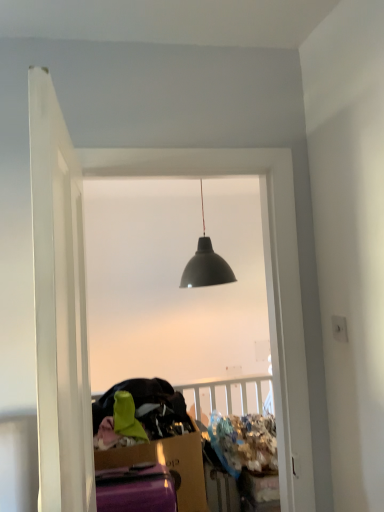
Question: Relative to white smooth door at left, is matte black lampshade at center in front or behind?

Choices:
 (A) front
 (B) behind

Answer: (B)

Question: Does point (168, 289) appear closer or farther from the camera than point (46, 408)?

Choices:
 (A) closer
 (B) farther

Answer: (B)

Question: Considering the positions of matte black lampshade at center and white smooth door at left in the image, is matte black lampshade at center taller or shorter than white smooth door at left?

Choices:
 (A) tall
 (B) short

Answer: (A)

Question: Considering the positions of white smooth door at left and matte black lampshade at center in the image, is white smooth door at left bigger or smaller than matte black lampshade at center?

Choices:
 (A) small
 (B) big

Answer: (B)

Question: From a real-world perspective, relative to matte black lampshade at center, is white smooth door at left vertically above or below?

Choices:
 (A) above
 (B) below

Answer: (A)

Question: Is point (66, 262) positioned closer to the camera than point (92, 352)?

Choices:
 (A) closer
 (B) farther

Answer: (A)

Question: Considering their positions, is white smooth door at left located in front of or behind matte black lampshade at center?

Choices:
 (A) front
 (B) behind

Answer: (A)